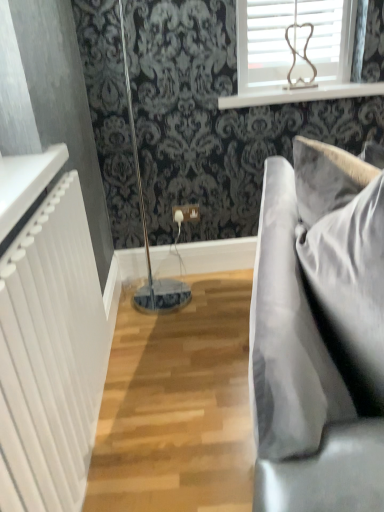
Question: From a real-world perspective, is white textured radiator at left positioned above or below velvet grey couch at right?

Choices:
 (A) above
 (B) below

Answer: (A)

Question: From the image's perspective, is white textured radiator at left positioned above or below velvet grey couch at right?

Choices:
 (A) above
 (B) below

Answer: (B)

Question: Estimate the real-world distances between objects in this image. Which object is closer to the white textured radiator at left?

Choices:
 (A) white wood window sill at upper center
 (B) velvet grey couch at right
 (C) velvet gray pillow at right

Answer: (B)

Question: Which of these objects is positioned closest to the velvet gray pillow at right?

Choices:
 (A) white wood window sill at upper center
 (B) white textured radiator at left
 (C) velvet grey couch at right

Answer: (C)